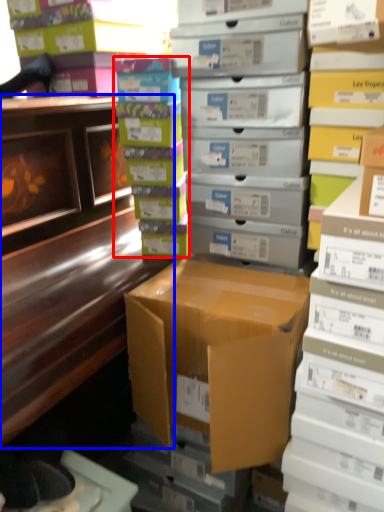
Question: Which object is further to the camera taking this photo, book (highlighted by a red box) or desk (highlighted by a blue box)?

Choices:
 (A) book
 (B) desk

Answer: (A)